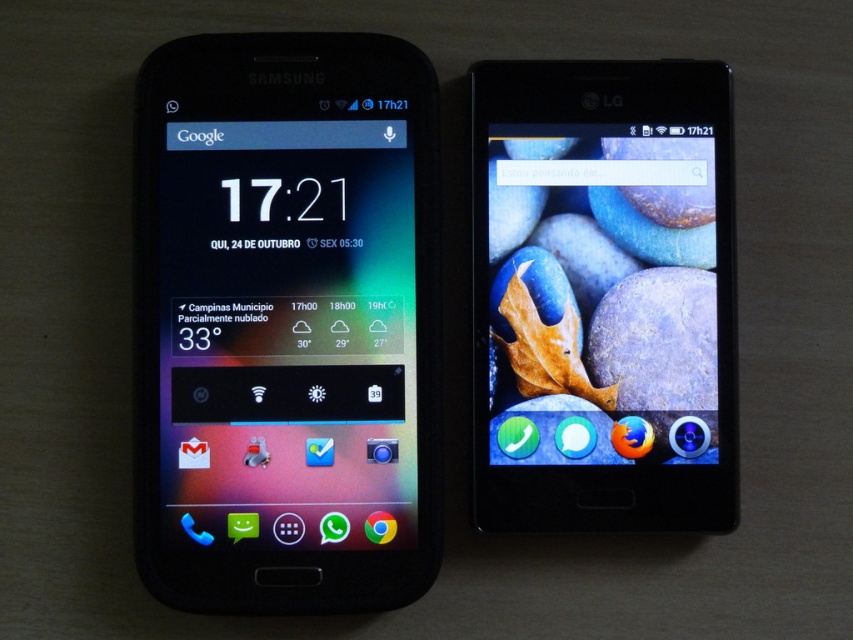
Is matte black phone at left thinner than matte black phone at right?

No.

Between matte black phone at left and matte black phone at right, which one has less height?

matte black phone at right

This screenshot has width=853, height=640. In order to click on matte black phone at left in this screenshot , I will do `click(285, 323)`.

The width and height of the screenshot is (853, 640). What are the coordinates of `matte black phone at left` in the screenshot? It's located at (285, 323).